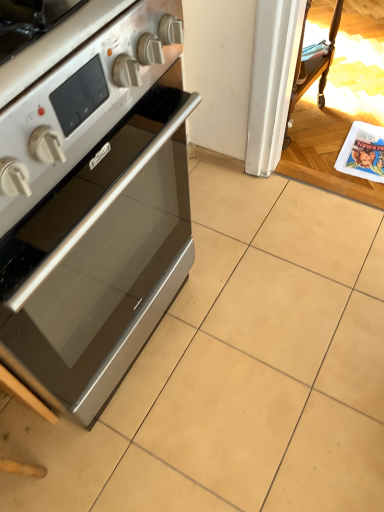
Question: Does satin silver oven at left touch white glossy magazine at right?

Choices:
 (A) no
 (B) yes

Answer: (A)

Question: Would you consider satin silver oven at left to be distant from white glossy magazine at right?

Choices:
 (A) no
 (B) yes

Answer: (B)

Question: Is satin silver oven at left outside of white glossy magazine at right?

Choices:
 (A) yes
 (B) no

Answer: (A)

Question: Can you confirm if satin silver oven at left is wider than white glossy magazine at right?

Choices:
 (A) yes
 (B) no

Answer: (A)

Question: Considering the relative positions of satin silver oven at left and white glossy magazine at right in the image provided, is satin silver oven at left to the right of white glossy magazine at right from the viewer's perspective?

Choices:
 (A) yes
 (B) no

Answer: (B)

Question: Is satin silver oven at left oriented away from white glossy magazine at right?

Choices:
 (A) yes
 (B) no

Answer: (B)

Question: Considering the relative sizes of white glossy magazine at right and satin silver oven at left in the image provided, is white glossy magazine at right shorter than satin silver oven at left?

Choices:
 (A) no
 (B) yes

Answer: (B)

Question: Is white glossy magazine at right smaller than satin silver oven at left?

Choices:
 (A) no
 (B) yes

Answer: (B)

Question: Is white glossy magazine at right oriented towards satin silver oven at left?

Choices:
 (A) no
 (B) yes

Answer: (A)

Question: Is white glossy magazine at right at the left side of satin silver oven at left?

Choices:
 (A) no
 (B) yes

Answer: (A)

Question: Is white glossy magazine at right positioned in front of satin silver oven at left?

Choices:
 (A) no
 (B) yes

Answer: (A)

Question: Can you confirm if white glossy magazine at right is thinner than satin silver oven at left?

Choices:
 (A) no
 (B) yes

Answer: (B)

Question: Is white glossy magazine at right to the left or to the right of satin silver oven at left in the image?

Choices:
 (A) left
 (B) right

Answer: (B)